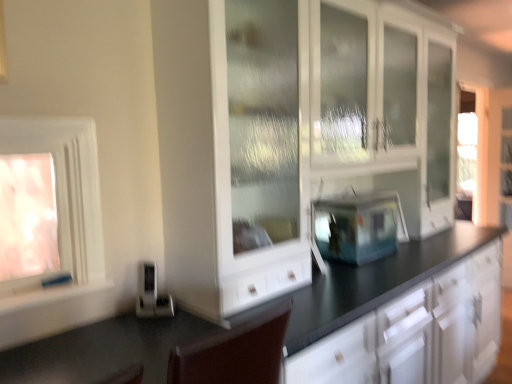
What are the coordinates of `transparent glass fish tank at center, placed as the 1th appliance when sorted from right to left` in the screenshot? It's located at (358, 226).

Image resolution: width=512 pixels, height=384 pixels. What do you see at coordinates (68, 189) in the screenshot?
I see `white glossy window at left, placed as the 2th window when sorted from left to right` at bounding box center [68, 189].

Describe the element at coordinates (62, 298) in the screenshot. I see `white matte window sill at lower left` at that location.

Identify the location of transparent glass fish tank at center, the second appliance positioned from the front. The image size is (512, 384). (358, 226).

In the image, is white matte window sill at lower left positioned in front of or behind transparent glass fish tank at center, which is the 1th appliance from back to front?

Visually, white matte window sill at lower left is located in front of transparent glass fish tank at center, which is the 1th appliance from back to front.

Between white matte window sill at lower left and transparent glass fish tank at center, which is the 1th appliance from back to front, which one has less height?

With less height is white matte window sill at lower left.

Based on the photo, is white matte window sill at lower left positioned far away from transparent glass fish tank at center, which is the 1th appliance from back to front?

Yes, white matte window sill at lower left and transparent glass fish tank at center, which is the 1th appliance from back to front, are located far from each other.

Does point (39, 306) come behind point (334, 253)?

That is False.

From a real-world perspective, is white glossy window at left, marked as the first window in a right-to-left arrangement, over satin silver toaster at lower left, which appears as the 2th appliance when viewed from the back?

Correct, in the physical world, white glossy window at left, marked as the first window in a right-to-left arrangement, is higher than satin silver toaster at lower left, which appears as the 2th appliance when viewed from the back.

Are white glossy window at left, placed as the 2th window when sorted from left to right, and satin silver toaster at lower left, the first appliance when ordered from front to back, making contact?

white glossy window at left, placed as the 2th window when sorted from left to right, and satin silver toaster at lower left, the first appliance when ordered from front to back, are clearly separated.

Who is taller, white glossy window at left, marked as the first window in a right-to-left arrangement, or satin silver toaster at lower left, the second appliance viewed from the right?

Standing taller between the two is white glossy window at left, marked as the first window in a right-to-left arrangement.

Can you confirm if white glossy window at left, placed as the 2th window when sorted from left to right, is wider than satin silver toaster at lower left, which appears as the 2th appliance when viewed from the back?

Yes.

From a real-world perspective, who is located lower, white matte window sill at lower left or white glossy cabinet at center?

white matte window sill at lower left, from a real-world perspective.

From the image's perspective, is white matte window sill at lower left located beneath white glossy cabinet at center?

Yes.

This screenshot has height=384, width=512. What are the coordinates of `window sill behind the white glossy cabinet at center` in the screenshot? It's located at (62, 298).

Considering the points (25, 301) and (259, 93), which point is in front, point (25, 301) or point (259, 93)?

The point (25, 301) is closer.

Which is more to the right, white glossy cabinet at center or white matte window sill at lower left?

Positioned to the right is white glossy cabinet at center.

Does white glossy cabinet at center turn towards white matte window sill at lower left?

No.

Is white glossy cabinet at center next to white matte window sill at lower left?

They are not placed beside each other.

Does white glossy cabinet at center have a smaller size compared to white matte window sill at lower left?

No, white glossy cabinet at center is not smaller than white matte window sill at lower left.

Does point (345, 213) appear closer or farther from the camera than point (92, 291)?

Point (345, 213) appears to be farther away from the viewer than point (92, 291).

From a real-world perspective, who is located higher, transparent glass fish tank at center, which is the 1th appliance from back to front, or white matte window sill at lower left?

In real-world perspective, transparent glass fish tank at center, which is the 1th appliance from back to front, is above.

Is transparent glass fish tank at center, placed as the 1th appliance when sorted from right to left, spatially inside white matte window sill at lower left, or outside of it?

The correct answer is: outside.

Who is taller, transparent glass fish tank at center, which is the second appliance from left to right, or white matte window sill at lower left?

transparent glass fish tank at center, which is the second appliance from left to right.

Is satin silver toaster at lower left, the second appliance viewed from the right, aimed at translucent glass window at left, positioned as the first window in left-to-right order?

No, satin silver toaster at lower left, the second appliance viewed from the right, does not turn towards translucent glass window at left, positioned as the first window in left-to-right order.

Looking at this image, from a real-world perspective, which is physically below, satin silver toaster at lower left, which appears as the 2th appliance when viewed from the back, or translucent glass window at left, which ranks as the second window in right-to-left order?

satin silver toaster at lower left, which appears as the 2th appliance when viewed from the back, is physically lower.

From the image's perspective, which is below, satin silver toaster at lower left, the first appliance when ordered from front to back, or translucent glass window at left, positioned as the first window in left-to-right order?

satin silver toaster at lower left, the first appliance when ordered from front to back, is shown below in the image.

Based on the photo, would you say satin silver toaster at lower left, the 1th appliance from the left, contains translucent glass window at left, positioned as the first window in left-to-right order?

No.

Which is behind, point (49, 131) or point (29, 232)?

The point (29, 232) is behind.

Which object is further away from the camera, white glossy window at left, placed as the 2th window when sorted from left to right, or translucent glass window at left, positioned as the first window in left-to-right order?

translucent glass window at left, positioned as the first window in left-to-right order, is more distant.

Which object is positioned more to the right, white glossy window at left, marked as the first window in a right-to-left arrangement, or translucent glass window at left, which ranks as the second window in right-to-left order?

white glossy window at left, marked as the first window in a right-to-left arrangement, is more to the right.

From the image's perspective, is white glossy window at left, marked as the first window in a right-to-left arrangement, located above or below translucent glass window at left, which ranks as the second window in right-to-left order?

Based on their image positions, white glossy window at left, marked as the first window in a right-to-left arrangement, is located above translucent glass window at left, which ranks as the second window in right-to-left order.

Identify the location of window sill on the left of transparent glass fish tank at center, which is the 1th appliance from back to front. This screenshot has height=384, width=512. (62, 298).

Locate an element on the screen. Image resolution: width=512 pixels, height=384 pixels. appliance that is the 1st one when counting backward from the white glossy window at left, marked as the first window in a right-to-left arrangement is located at coordinates (152, 295).

Based on their spatial positions, is translucent glass window at left, positioned as the first window in left-to-right order, or transparent glass fish tank at center, which is the 1th appliance from back to front, closer to satin silver toaster at lower left, which appears as the 2th appliance when viewed from the back?

translucent glass window at left, positioned as the first window in left-to-right order, lies closer to satin silver toaster at lower left, which appears as the 2th appliance when viewed from the back, than the other object.

Considering their positions, is white glossy window at left, placed as the 2th window when sorted from left to right, positioned closer to white matte window sill at lower left than satin silver toaster at lower left, the second appliance viewed from the right?

white glossy window at left, placed as the 2th window when sorted from left to right, is positioned closer to the anchor white matte window sill at lower left.

Based on their spatial positions, is satin silver toaster at lower left, the first appliance when ordered from front to back, or translucent glass window at left, which ranks as the second window in right-to-left order, further from white matte window sill at lower left?

satin silver toaster at lower left, the first appliance when ordered from front to back, lies further to white matte window sill at lower left than the other object.

Estimate the real-world distances between objects in this image. Which object is closer to satin silver toaster at lower left, the 1th appliance from the left, translucent glass window at left, which ranks as the second window in right-to-left order, or white glossy window at left, placed as the 2th window when sorted from left to right?

Among the two, white glossy window at left, placed as the 2th window when sorted from left to right, is located nearer to satin silver toaster at lower left, the 1th appliance from the left.

Based on their spatial positions, is white glossy cabinet at center or white matte window sill at lower left further from transparent glass fish tank at center, which is the second appliance from left to right?

Based on the image, white matte window sill at lower left appears to be further to transparent glass fish tank at center, which is the second appliance from left to right.

Considering their positions, is transparent glass fish tank at center, the second appliance positioned from the front, positioned further to white glossy window at left, placed as the 2th window when sorted from left to right, than white glossy cabinet at center?

Among the two, transparent glass fish tank at center, the second appliance positioned from the front, is located further to white glossy window at left, placed as the 2th window when sorted from left to right.

Looking at the image, which one is located closer to satin silver toaster at lower left, which appears as the 2th appliance when viewed from the back, white glossy cabinet at center or transparent glass fish tank at center, which is the 1th appliance from back to front?

white glossy cabinet at center.

Estimate the real-world distances between objects in this image. Which object is further from satin silver toaster at lower left, the second appliance viewed from the right, white matte window sill at lower left or transparent glass fish tank at center, which is the second appliance from left to right?

transparent glass fish tank at center, which is the second appliance from left to right.

Identify the location of appliance between translucent glass window at left, which ranks as the second window in right-to-left order, and transparent glass fish tank at center, which is the second appliance from left to right, from left to right. The width and height of the screenshot is (512, 384). (152, 295).

Where is `window sill between white glossy window at left, marked as the first window in a right-to-left arrangement, and transparent glass fish tank at center, which is the second appliance from left to right`? The image size is (512, 384). window sill between white glossy window at left, marked as the first window in a right-to-left arrangement, and transparent glass fish tank at center, which is the second appliance from left to right is located at coordinates (62, 298).

Locate an element on the screen. appliance located between white glossy window at left, placed as the 2th window when sorted from left to right, and transparent glass fish tank at center, placed as the 1th appliance when sorted from right to left, in the left-right direction is located at coordinates (152, 295).

Where is `window between translucent glass window at left, which ranks as the second window in right-to-left order, and white glossy cabinet at center, in the horizontal direction`? The width and height of the screenshot is (512, 384). window between translucent glass window at left, which ranks as the second window in right-to-left order, and white glossy cabinet at center, in the horizontal direction is located at coordinates (68, 189).